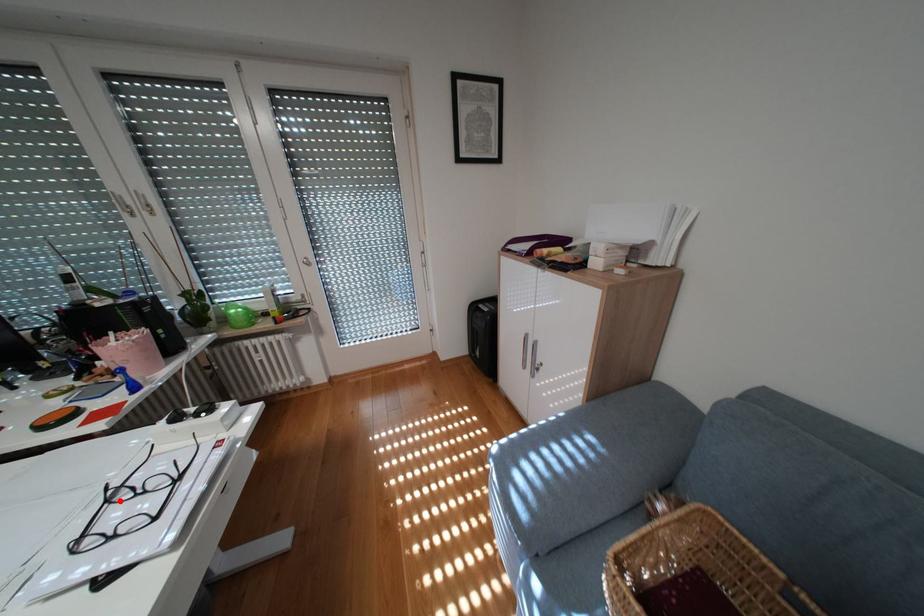
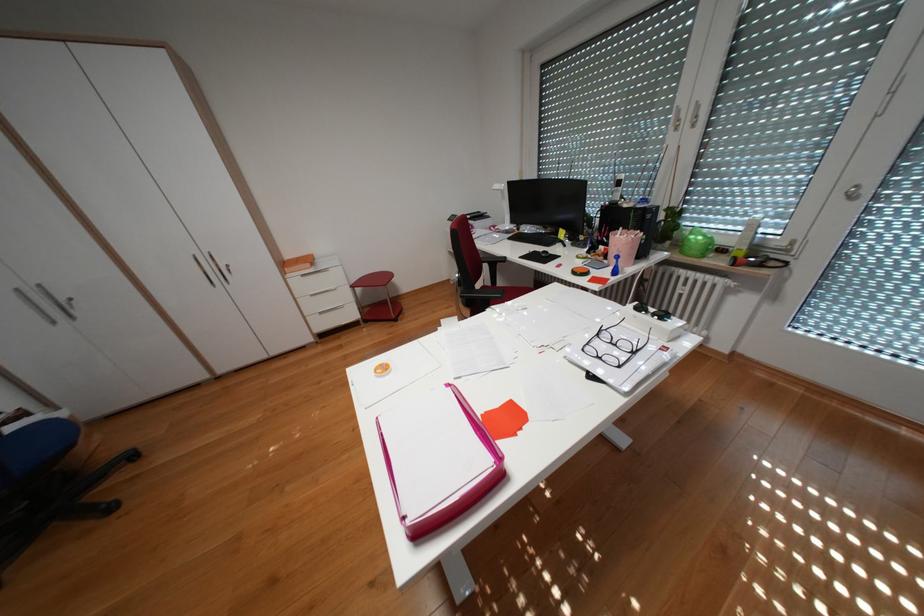
The point at the highlighted location is marked in the first image. Where is the corresponding point in the second image?

(610, 334)